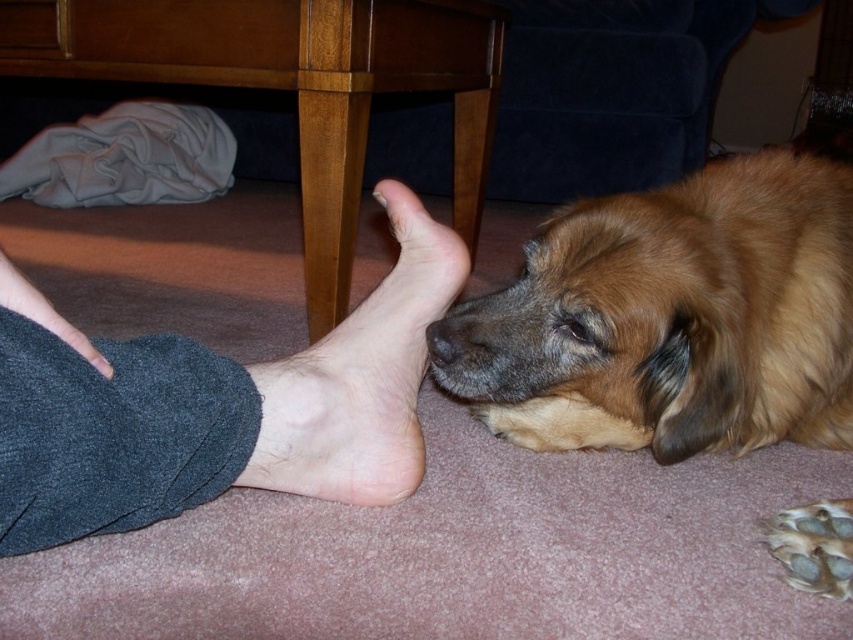
Does golden fur dog at lower right have a greater height compared to matte skin toe at lower center?

Yes, golden fur dog at lower right is taller than matte skin toe at lower center.

Identify the location of golden fur dog at lower right. (675, 317).

Can you confirm if matte skin toe at lower center is smaller than white matte toe at center?

Yes.

At what (x,y) coordinates should I click in order to perform the action: click on matte skin toe at lower center. Please return your answer as a coordinate pair (x, y). Looking at the image, I should click on (99, 362).

Identify the location of matte skin toe at lower center. (99, 362).

Does golden fur dog at lower right have a lesser height compared to skinny bare foot at lower left?

No, golden fur dog at lower right is not shorter than skinny bare foot at lower left.

Which of these two, golden fur dog at lower right or skinny bare foot at lower left, stands taller?

With more height is golden fur dog at lower right.

Who is more distant from viewer, (759, 422) or (367, 365)?

Point (759, 422)

Identify the location of golden fur dog at lower right. (675, 317).